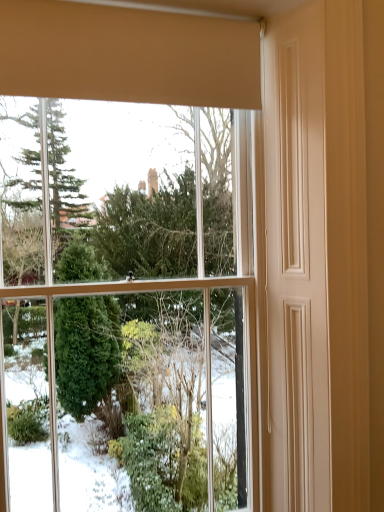
Question: Is clear glass window at upper center to the left or to the right of beige matte curtain at upper center in the image?

Choices:
 (A) right
 (B) left

Answer: (B)

Question: In terms of size, does clear glass window at upper center appear bigger or smaller than beige matte curtain at upper center?

Choices:
 (A) big
 (B) small

Answer: (A)

Question: From the image's perspective, is clear glass window at upper center positioned above or below beige matte curtain at upper center?

Choices:
 (A) below
 (B) above

Answer: (A)

Question: Relative to clear glass window at upper center, is beige matte curtain at upper center in front or behind?

Choices:
 (A) front
 (B) behind

Answer: (A)

Question: Is beige matte curtain at upper center to the left or to the right of clear glass window at upper center in the image?

Choices:
 (A) right
 (B) left

Answer: (A)

Question: Is beige matte curtain at upper center taller or shorter than clear glass window at upper center?

Choices:
 (A) short
 (B) tall

Answer: (A)

Question: In terms of size, does beige matte curtain at upper center appear bigger or smaller than clear glass window at upper center?

Choices:
 (A) big
 (B) small

Answer: (B)